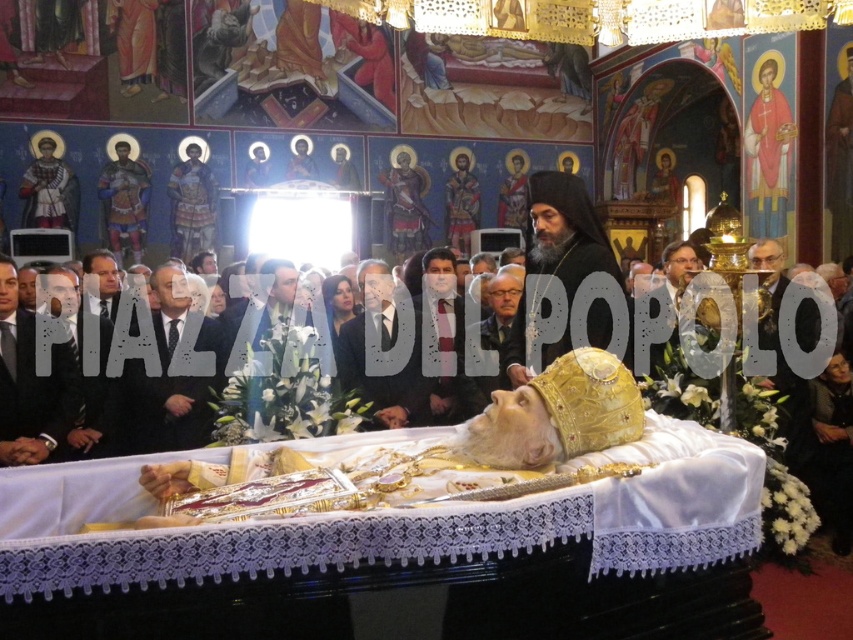
During the ceremony, you need to move from the entrance to the casket. There are two people in the way wearing a dark suit at center and a black suit at left. Which person should you avoid bumping into first?

The black suit at left is behind dark suit at center, so you should avoid bumping into the dark suit at center first since it is closer to your path.

You are attending the ceremony and want to take a photo of the dark suit at center. Where should you position yourself to capture it in the frame?

To capture the dark suit at center in your photo, position yourself facing the center of the church where the dark suit at center is located at point coordinates approximately 0.588 on the x axis and 0.449 on the y axis.

You are an event planner organizing the seating arrangement for the ceremony. You need to place a small bouquet between the gold textured crown at center and the black suit at left. Which object should the bouquet be closer to if you want it to be near the larger object?

The black suit at left occupies more space than the gold textured crown at center, so the bouquet should be placed closer to the black suit at left to be near the larger object.